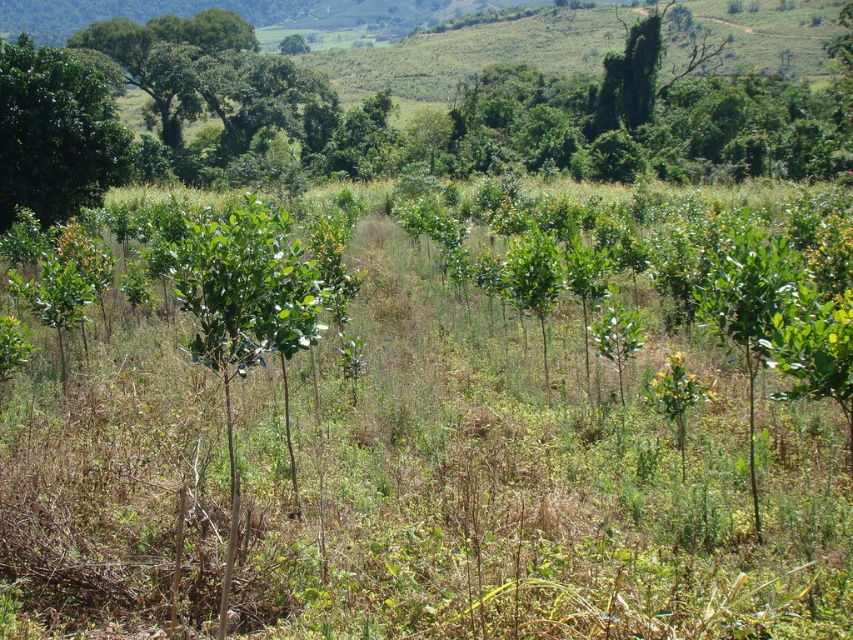
Question: Which of the following is the closest to the observer?

Choices:
 (A) (109, 97)
 (B) (305, 38)

Answer: (A)

Question: Does green leafy tree at upper left appear on the right side of green leafy tree at upper center?

Choices:
 (A) no
 (B) yes

Answer: (B)

Question: Which object appears farthest from the camera in this image?

Choices:
 (A) green leafy tree at upper left
 (B) green leafy tree at upper center

Answer: (B)

Question: Is green leafy tree at upper left further to the viewer compared to green leafy tree at upper center?

Choices:
 (A) yes
 (B) no

Answer: (B)

Question: Which point is closer to the camera taking this photo?

Choices:
 (A) (300, 49)
 (B) (33, 54)

Answer: (B)

Question: In this image, where is green leafy tree at upper left located relative to green leafy tree at upper center?

Choices:
 (A) below
 (B) above

Answer: (A)